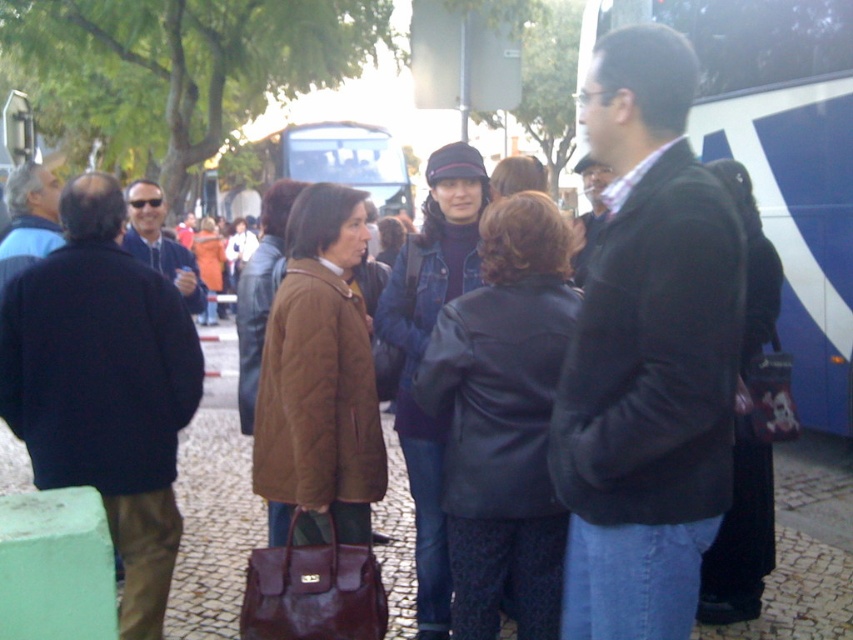
Question: Observing the image, what is the correct spatial positioning of dark brown leather bag at lower left in reference to blue painted bus at right?

Choices:
 (A) left
 (B) right

Answer: (A)

Question: Observing the image, what is the correct spatial positioning of dark brown leather bag at lower left in reference to blue painted bus at right?

Choices:
 (A) below
 (B) above

Answer: (A)

Question: Which point is closer to the camera?

Choices:
 (A) (308, 160)
 (B) (759, 188)
 (C) (155, 481)

Answer: (C)

Question: Where is dark brown leather bag at lower left located in relation to blue metallic bus at center in the image?

Choices:
 (A) above
 (B) below

Answer: (B)

Question: Which of these objects is positioned closest to the blue metallic bus at center?

Choices:
 (A) blue painted bus at right
 (B) dark brown leather bag at lower left

Answer: (A)

Question: Which point is farther from the camera taking this photo?

Choices:
 (A) (80, 227)
 (B) (254, 164)

Answer: (B)